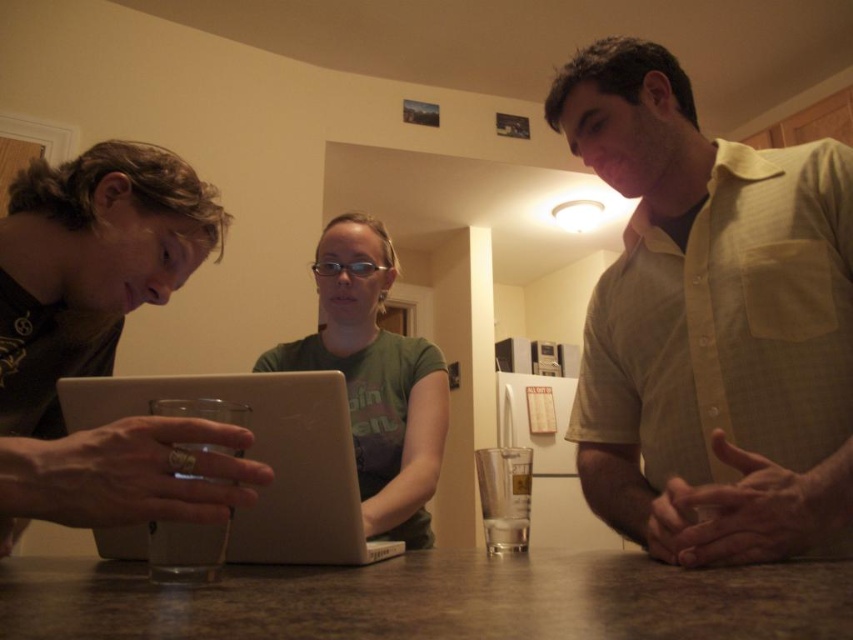
Between point (161, 212) and point (367, 228), which one is positioned in front?

Point (161, 212)

Is matte black laptop at left taller than green matte shirt at center?

Incorrect, matte black laptop at left's height is not larger of green matte shirt at center's.

Is point (167, 515) closer to viewer compared to point (361, 296)?

That is True.

The image size is (853, 640). Identify the location of matte black laptop at left. (94, 332).

Is point (784, 291) farther from camera compared to point (114, 464)?

That is True.

Is light yellow button-down shirt at right to the right of matte black laptop at left from the viewer's perspective?

Yes, light yellow button-down shirt at right is to the right of matte black laptop at left.

Who is more forward, [712,268] or [117,332]?

Point [712,268] is in front.

At what (x,y) coordinates should I click in order to perform the action: click on light yellow button-down shirt at right. Please return your answer as a coordinate pair (x, y). Looking at the image, I should click on (711, 324).

Between point (107, 576) and point (229, 429), which one is positioned behind?

The point (107, 576) is behind.

Is point (518, 596) positioned after point (71, 362)?

No, (518, 596) is in front of (71, 362).

This screenshot has height=640, width=853. I want to click on brown laminate table at center, so click(x=431, y=600).